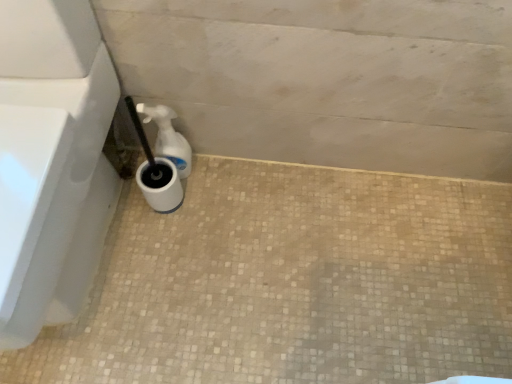
The height and width of the screenshot is (384, 512). Describe the element at coordinates (293, 283) in the screenshot. I see `white matte concrete at lower center` at that location.

Where is `white glossy toilet at lower left`? white glossy toilet at lower left is located at coordinates (51, 161).

Image resolution: width=512 pixels, height=384 pixels. What are the coordinates of `white plastic spray bottle at lower left` in the screenshot? It's located at (168, 137).

From a real-world perspective, between white glossy toilet at lower left and white plastic spray bottle at lower left, who is vertically lower?

white plastic spray bottle at lower left.

Locate an element on the screen. This screenshot has width=512, height=384. bath below the white plastic spray bottle at lower left (from the image's perspective) is located at coordinates point(51,161).

Could you tell me if white glossy toilet at lower left is turned towards white plastic spray bottle at lower left?

No, white glossy toilet at lower left is not oriented towards white plastic spray bottle at lower left.

Which of these two, white glossy toilet at lower left or white plastic spray bottle at lower left, stands taller?

Standing taller between the two is white glossy toilet at lower left.

Is white plastic spray bottle at lower left touching white glossy toilet at lower left?

No, white plastic spray bottle at lower left is not in contact with white glossy toilet at lower left.

Does white plastic spray bottle at lower left come in front of white glossy toilet at lower left?

No, white plastic spray bottle at lower left is further to the viewer.

Can you confirm if white plastic spray bottle at lower left is bigger than white glossy toilet at lower left?

Incorrect, white plastic spray bottle at lower left is not larger than white glossy toilet at lower left.

Considering the relative sizes of white plastic spray bottle at lower left and white glossy toilet at lower left in the image provided, is white plastic spray bottle at lower left thinner than white glossy toilet at lower left?

Yes.

Looking at the image, does white plastic spray bottle at lower left seem bigger or smaller compared to white matte concrete at lower center?

white plastic spray bottle at lower left is smaller than white matte concrete at lower center.

Is white plastic spray bottle at lower left behind white matte concrete at lower center?

Yes, white plastic spray bottle at lower left is behind white matte concrete at lower center.

Is white plastic spray bottle at lower left far away from white matte concrete at lower center?

No, white plastic spray bottle at lower left is not far from white matte concrete at lower center.

Which is farther, (170, 109) or (475, 210)?

The point (475, 210) is more distant.

Which is less distant, [331,200] or [138,112]?

Point [331,200] is farther from the camera than point [138,112].

In the image, is white matte concrete at lower center positioned in front of or behind white plastic spray bottle at lower left?

Visually, white matte concrete at lower center is located in front of white plastic spray bottle at lower left.

From the image's perspective, is white matte concrete at lower center located beneath white plastic spray bottle at lower left?

Yes, from the image's perspective, white matte concrete at lower center is beneath white plastic spray bottle at lower left.

Can you confirm if white matte concrete at lower center is bigger than white plastic spray bottle at lower left?

Correct, white matte concrete at lower center is larger in size than white plastic spray bottle at lower left.

Looking at this image, considering the relative sizes of white glossy toilet at lower left and white matte concrete at lower center in the image provided, is white glossy toilet at lower left thinner than white matte concrete at lower center?

Yes, white glossy toilet at lower left is thinner than white matte concrete at lower center.

Which object is positioned more to the left, white glossy toilet at lower left or white matte concrete at lower center?

From the viewer's perspective, white glossy toilet at lower left appears more on the left side.

From the image's perspective, which is above, white glossy toilet at lower left or white matte concrete at lower center?

white glossy toilet at lower left appears higher in the image.

Is white glossy toilet at lower left bigger than white matte concrete at lower center?

Correct, white glossy toilet at lower left is larger in size than white matte concrete at lower center.

Which point is more forward, [460,367] or [5,9]?

Positioned in front is point [5,9].

Which object is thinner, white matte concrete at lower center or white glossy toilet at lower left?

Thinner between the two is white glossy toilet at lower left.

Would you consider white matte concrete at lower center to be distant from white glossy toilet at lower left?

Actually, white matte concrete at lower center and white glossy toilet at lower left are a little close together.

Which object is positioned more to the left, white matte concrete at lower center or white glossy toilet at lower left?

white glossy toilet at lower left is more to the left.

In order to click on bath on the left of white plastic spray bottle at lower left in this screenshot , I will do [51, 161].

You are a GUI agent. You are given a task and a screenshot of the screen. Output one action in this format:
    pyautogui.click(x=<x>, y=<y>)
    Task: Click on the soap dispenser above the white glossy toilet at lower left (from the image's perspective)
    This screenshot has height=384, width=512.
    Given the screenshot: What is the action you would take?
    pyautogui.click(x=168, y=137)

When comparing their distances from white matte concrete at lower center, does white plastic spray bottle at lower left or white glossy toilet at lower left seem further?

Based on the image, white plastic spray bottle at lower left appears to be further to white matte concrete at lower center.

Looking at the image, which one is located further to white plastic spray bottle at lower left, white glossy toilet at lower left or white matte concrete at lower center?

The object further to white plastic spray bottle at lower left is white matte concrete at lower center.

In the scene shown: Which object lies further to the anchor point white matte concrete at lower center, white glossy toilet at lower left or white plastic spray bottle at lower left?

white plastic spray bottle at lower left is further to white matte concrete at lower center.

Based on the photo, looking at the image, which one is located closer to white plastic spray bottle at lower left, white matte concrete at lower center or white glossy toilet at lower left?

Based on the image, white glossy toilet at lower left appears to be nearer to white plastic spray bottle at lower left.

Considering their positions, is white matte concrete at lower center positioned further to white glossy toilet at lower left than white plastic spray bottle at lower left?

Based on the image, white matte concrete at lower center appears to be further to white glossy toilet at lower left.

Looking at this image, estimate the real-world distances between objects in this image. Which object is closer to white glossy toilet at lower left, white plastic spray bottle at lower left or white matte concrete at lower center?

white plastic spray bottle at lower left lies closer to white glossy toilet at lower left than the other object.

Identify the location of concrete positioned between white glossy toilet at lower left and white plastic spray bottle at lower left from near to far. This screenshot has width=512, height=384. (293, 283).